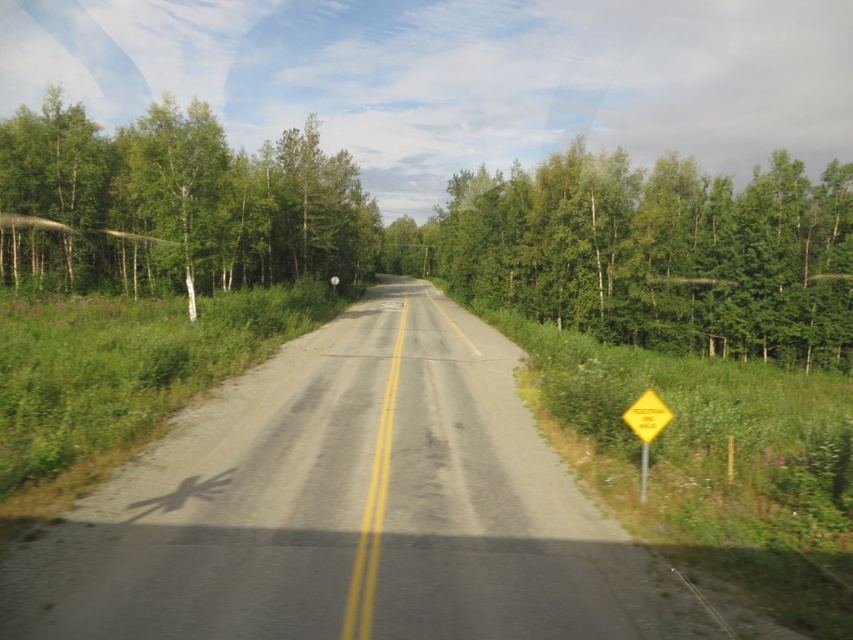
You are a hiker standing at the point marked by the coordinates point (173, 205). You want to walk towards the dense forested area in the background. Which direction should you head?

The point (173, 205) indicates a green leafy tree at left, so to reach the dense forested area in the background, you should head towards the right since the dense forest is on the opposite side of the road from the green leafy tree at left.

You are a pedestrian standing at the starting point of the road. You see two points marked on the road ahead of you. Which point is closer to you, point (689, 346) or point (641, 435)?

Point (641, 435) is closer to you because point (689, 346) is behind it.

You are a drone operator trying to capture aerial footage of the road scene. Your drone has a maximum flight distance of 30 meters. If you want to get a clear shot of the green leafy tree at left, will your drone be able to reach it without exceeding its maximum range?

The green leafy tree at left is 29.51 meters from camera, which is within the drone operator s 30 meters maximum flight distance. Therefore, the drone can reach the green leafy tree at left without exceeding its range.